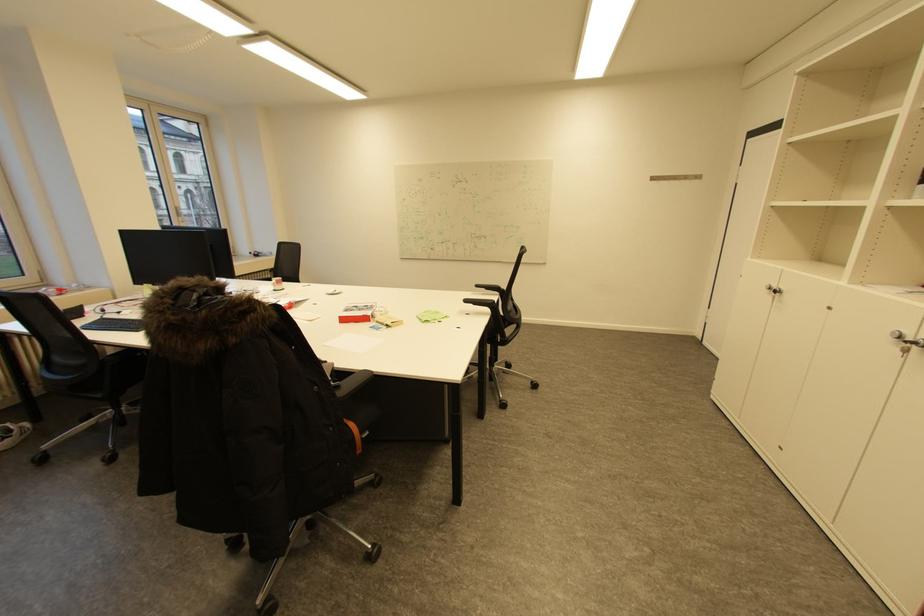
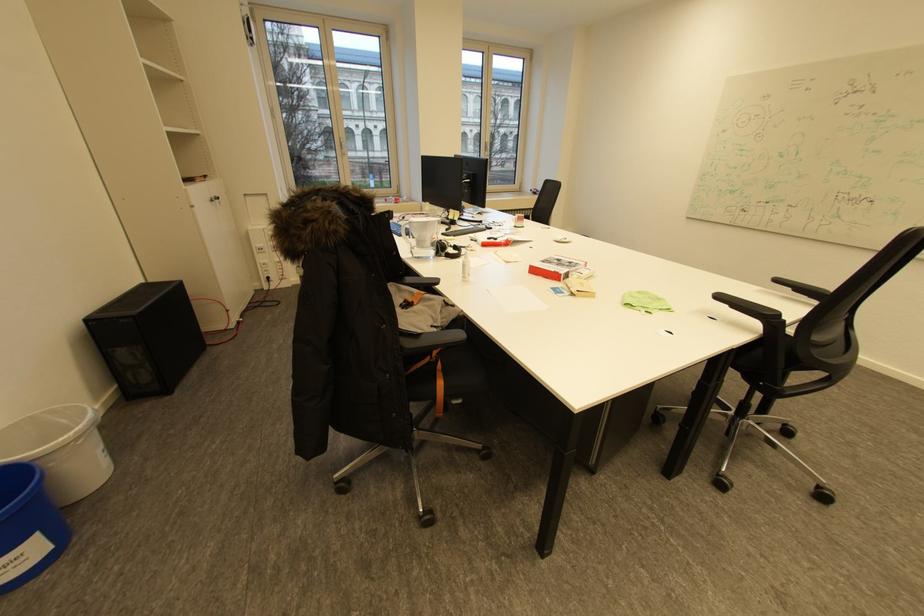
Locate, in the second image, the point that corresponds to pixel 372 307 in the first image.

(576, 262)